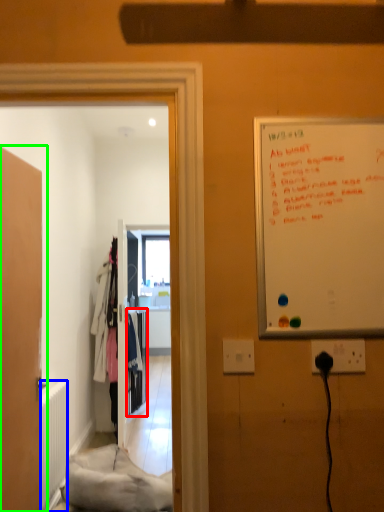
Question: Which object is the closest to the closet (highlighted by a red box)? Choose among these: radiator (highlighted by a blue box) or door (highlighted by a green box).

Choices:
 (A) radiator
 (B) door

Answer: (A)